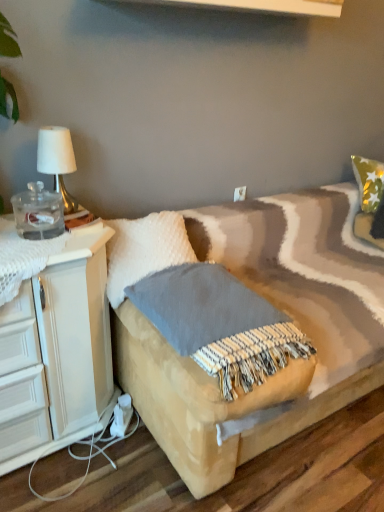
Question: Does white plastic electric outlet at upper center have a lesser height compared to white fluffy pillow at center?

Choices:
 (A) no
 (B) yes

Answer: (B)

Question: Considering the relative positions of white plastic electric outlet at upper center and white fluffy pillow at center in the image provided, is white plastic electric outlet at upper center behind white fluffy pillow at center?

Choices:
 (A) yes
 (B) no

Answer: (A)

Question: Does white plastic electric outlet at upper center have a greater width compared to white fluffy pillow at center?

Choices:
 (A) no
 (B) yes

Answer: (A)

Question: Considering the relative sizes of white plastic electric outlet at upper center and white fluffy pillow at center in the image provided, is white plastic electric outlet at upper center taller than white fluffy pillow at center?

Choices:
 (A) no
 (B) yes

Answer: (A)

Question: Can you confirm if white plastic electric outlet at upper center is smaller than white fluffy pillow at center?

Choices:
 (A) yes
 (B) no

Answer: (A)

Question: Which is correct: white plastic electric outlet at upper center is inside gold metallic table lamp at upper left, or outside of it?

Choices:
 (A) outside
 (B) inside

Answer: (A)

Question: From a real-world perspective, is white plastic electric outlet at upper center positioned above or below gold metallic table lamp at upper left?

Choices:
 (A) above
 (B) below

Answer: (B)

Question: Based on their sizes in the image, would you say white plastic electric outlet at upper center is bigger or smaller than gold metallic table lamp at upper left?

Choices:
 (A) big
 (B) small

Answer: (B)

Question: From the image's perspective, is white plastic electric outlet at upper center positioned above or below gold metallic table lamp at upper left?

Choices:
 (A) below
 (B) above

Answer: (A)

Question: Is white fluffy pillow at center in front of or behind white plastic electric outlet at upper center in the image?

Choices:
 (A) front
 (B) behind

Answer: (A)

Question: Is white fluffy pillow at center inside or outside of white plastic electric outlet at upper center?

Choices:
 (A) inside
 (B) outside

Answer: (B)

Question: Is point (147, 254) positioned closer to the camera than point (236, 197)?

Choices:
 (A) farther
 (B) closer

Answer: (B)

Question: From the image's perspective, is white fluffy pillow at center located above or below white plastic electric outlet at upper center?

Choices:
 (A) above
 (B) below

Answer: (B)

Question: From the image's perspective, relative to white fluffy pillow at center, is gold metallic table lamp at upper left above or below?

Choices:
 (A) below
 (B) above

Answer: (B)

Question: In the image, is gold metallic table lamp at upper left on the left side or the right side of white fluffy pillow at center?

Choices:
 (A) left
 (B) right

Answer: (A)